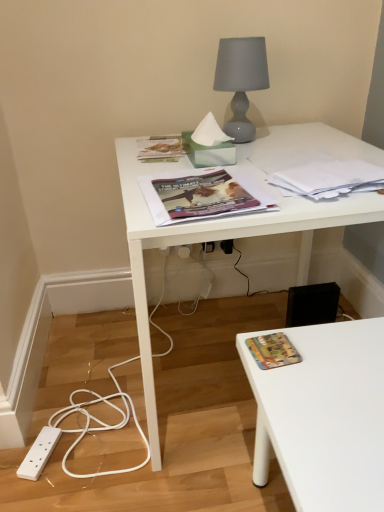
What is the approximate height of matte green paperback book at upper center, positioned as the 1th paperback book in top-to-bottom order?

The height of matte green paperback book at upper center, positioned as the 1th paperback book in top-to-bottom order, is 1.12 inches.

This screenshot has width=384, height=512. Describe the element at coordinates (318, 174) in the screenshot. I see `white paper at upper right, which is counted as the first paperback book, starting from the front` at that location.

This screenshot has height=512, width=384. Identify the location of white plastic power plugs and sockets at lower left. (39, 453).

Where is `black plastic electric outlet at lower center, which appears as the second electric outlet when viewed from the left`? This screenshot has height=512, width=384. black plastic electric outlet at lower center, which appears as the second electric outlet when viewed from the left is located at coordinates (227, 246).

Between point (230, 241) and point (373, 186), which one is positioned behind?

Positioned behind is point (230, 241).

Which object is further away from the camera taking this photo, black plastic electric outlet at lower center, which appears as the second electric outlet when viewed from the left, or white paper at upper right, which is the 1th paperback book from right to left?

black plastic electric outlet at lower center, which appears as the second electric outlet when viewed from the left, is further away from the camera.

Choose the correct answer: Is black plastic electric outlet at lower center, which appears as the second electric outlet when viewed from the left, inside white paper at upper right, the second paperback book in the top-to-bottom sequence, or outside it?

black plastic electric outlet at lower center, which appears as the second electric outlet when viewed from the left, lies outside white paper at upper right, the second paperback book in the top-to-bottom sequence.

How much distance is there between black plastic electric outlet at lower center, which appears as the second electric outlet when viewed from the left, and white paper at upper right, the second paperback book in the top-to-bottom sequence?

black plastic electric outlet at lower center, which appears as the second electric outlet when viewed from the left, is 28.89 inches away from white paper at upper right, the second paperback book in the top-to-bottom sequence.

Would you say black plastic electric outlet at lower center, which appears as the second electric outlet when viewed from the left, contains matte magazine at center, positioned as the first book cover in top-to-bottom order?

No, matte magazine at center, positioned as the first book cover in top-to-bottom order, is not inside black plastic electric outlet at lower center, which appears as the second electric outlet when viewed from the left.

Consider the image. Which object is thinner, black plastic electric outlet at lower center, which appears as the second electric outlet when viewed from the left, or matte magazine at center, the 2th book cover ordered from the bottom?

Thinner between the two is black plastic electric outlet at lower center, which appears as the second electric outlet when viewed from the left.

Which is behind, point (220, 243) or point (217, 192)?

Positioned behind is point (220, 243).

Can you confirm if black plastic electric outlet at lower center, which appears as the second electric outlet when viewed from the left, is taller than matte magazine at center, the 2th book cover ordered from the bottom?

Indeed, black plastic electric outlet at lower center, which appears as the second electric outlet when viewed from the left, has a greater height compared to matte magazine at center, the 2th book cover ordered from the bottom.

Which of these two, multicolored fabric book at lower right, which appears as the 1th book cover when ordered from the bottom, or matte magazine at center, the 2th book cover ordered from the bottom, stands shorter?

Standing shorter between the two is multicolored fabric book at lower right, which appears as the 1th book cover when ordered from the bottom.

From the image's perspective, is multicolored fabric book at lower right, which appears as the 1th book cover when ordered from the bottom, positioned above or below matte magazine at center, the 2th book cover ordered from the bottom?

Based on their image positions, multicolored fabric book at lower right, which appears as the 1th book cover when ordered from the bottom, is located beneath matte magazine at center, the 2th book cover ordered from the bottom.

From a real-world perspective, between multicolored fabric book at lower right, the second book cover from the top, and matte magazine at center, positioned as the first book cover in top-to-bottom order, who is vertically higher?

matte magazine at center, positioned as the first book cover in top-to-bottom order.

Visually, is multicolored fabric book at lower right, which appears as the 1th book cover when ordered from the bottom, positioned to the left or to the right of matte magazine at center, positioned as the first book cover in top-to-bottom order?

multicolored fabric book at lower right, which appears as the 1th book cover when ordered from the bottom, is positioned on matte magazine at center, positioned as the first book cover in top-to-bottom order,'s right side.

From a real-world perspective, which object stands above the other?

matte magazine at center, positioned as the first book cover in top-to-bottom order, is physically above.

Is white glossy desk at upper center positioned with its back to matte magazine at center, positioned as the first book cover in top-to-bottom order?

No, matte magazine at center, positioned as the first book cover in top-to-bottom order, is not at the back of white glossy desk at upper center.

Can you tell me how much white glossy desk at upper center and matte magazine at center, positioned as the first book cover in top-to-bottom order, differ in facing direction?

1.47 degrees.

Based on the photo, between white glossy desk at upper center and matte magazine at center, positioned as the first book cover in top-to-bottom order, which one is positioned behind?

matte magazine at center, positioned as the first book cover in top-to-bottom order, is further away from the camera.

From a real-world perspective, which is physically above, white paper at upper right, the second paperback book positioned from the back, or white glossy desk at upper center?

white paper at upper right, the second paperback book positioned from the back.

How far apart are white paper at upper right, placed as the first paperback book when sorted from bottom to top, and white glossy desk at upper center?

Answer: A distance of 6.10 inches exists between white paper at upper right, placed as the first paperback book when sorted from bottom to top, and white glossy desk at upper center.

Is point (337, 186) in front of point (376, 219)?

No, it is not.

Can you tell me how much white paper at upper right, the second paperback book in the top-to-bottom sequence, and white glossy desk at upper center differ in facing direction?

white paper at upper right, the second paperback book in the top-to-bottom sequence, and white glossy desk at upper center are facing 3.69 degrees away from each other.

From the image's perspective, does white glossy desk at upper center appear higher than white plastic electric outlet at lower center, which is the first electric outlet in left-to-right order?

Incorrect, from the image's perspective, white glossy desk at upper center is lower than white plastic electric outlet at lower center, which is the first electric outlet in left-to-right order.

From their relative heights in the image, would you say white glossy desk at upper center is taller or shorter than white plastic electric outlet at lower center, which is the 2th electric outlet in right-to-left order?

white glossy desk at upper center is taller than white plastic electric outlet at lower center, which is the 2th electric outlet in right-to-left order.

Considering the sizes of objects white glossy desk at upper center and white plastic electric outlet at lower center, which is the first electric outlet in left-to-right order, in the image provided, who is thinner, white glossy desk at upper center or white plastic electric outlet at lower center, which is the first electric outlet in left-to-right order,?

white plastic electric outlet at lower center, which is the first electric outlet in left-to-right order.

From a real-world perspective, who is located lower, white glossy desk at upper center or white plastic electric outlet at lower center, which is the 2th electric outlet in right-to-left order?

white plastic electric outlet at lower center, which is the 2th electric outlet in right-to-left order.

From the image's perspective, does matte magazine at center, positioned as the first book cover in top-to-bottom order, appear lower than matte gray glass lamp at upper center?

Yes.

Is matte magazine at center, the 2th book cover ordered from the bottom, spatially inside matte gray glass lamp at upper center, or outside of it?

matte magazine at center, the 2th book cover ordered from the bottom, is not inside matte gray glass lamp at upper center, it's outside.

You are a GUI agent. You are given a task and a screenshot of the screen. Output one action in this format:
    pyautogui.click(x=<x>, y=<y>)
    Task: Click on the lamp behind the matte magazine at center, positioned as the first book cover in top-to-bottom order
    This screenshot has width=384, height=512.
    Given the screenshot: What is the action you would take?
    pyautogui.click(x=241, y=80)

What's the angular difference between matte magazine at center, the 2th book cover ordered from the bottom, and matte gray glass lamp at upper center's facing directions?

3.72 degrees separate the facing orientations of matte magazine at center, the 2th book cover ordered from the bottom, and matte gray glass lamp at upper center.

Which electric outlet is the 1st one when counting from the left side of the white paper at upper right, the second paperback book positioned from the back? Please provide its 2D coordinates.

[(227, 246)]

Identify the location of the 2nd book cover in front of the black plastic electric outlet at lower center, which appears as the second electric outlet when viewed from the left. This screenshot has width=384, height=512. 202,196.

Estimate the real-world distances between objects in this image. Which object is further from white glossy desk at upper center, black plastic electric outlet at lower center, which is the 1th electric outlet in right-to-left order, or matte green paperback book at upper center, which appears as the 1th paperback book when viewed from the left?

Among the two, black plastic electric outlet at lower center, which is the 1th electric outlet in right-to-left order, is located further to white glossy desk at upper center.

Based on their spatial positions, is matte gray glass lamp at upper center or white glossy desk at upper center further from matte green paperback book at upper center, the 1th paperback book viewed from the back?

Based on the image, white glossy desk at upper center appears to be further to matte green paperback book at upper center, the 1th paperback book viewed from the back.

From the image, which object appears to be farther from multicolored fabric book at lower right, which appears as the 1th book cover when ordered from the bottom, white plastic electric outlet at lower center, which is the first electric outlet in left-to-right order, or white paper at upper right, which is the 1th paperback book from right to left?

white plastic electric outlet at lower center, which is the first electric outlet in left-to-right order.

Looking at the image, which one is located further to matte gray glass lamp at upper center, white plastic power plugs and sockets at lower left or white paper at upper right, the second paperback book positioned from the back?

white plastic power plugs and sockets at lower left is positioned further to the anchor matte gray glass lamp at upper center.

Which object lies nearer to the anchor point matte green paperback book at upper center, which appears as the 1th paperback book when viewed from the left, white glossy desk at upper center or white paper at upper right, which is counted as the first paperback book, starting from the front?

white glossy desk at upper center lies closer to matte green paperback book at upper center, which appears as the 1th paperback book when viewed from the left, than the other object.

Estimate the real-world distances between objects in this image. Which object is closer to white plastic power plugs and sockets at lower left, white plastic electric outlet at lower center, which is the 2th electric outlet in right-to-left order, or multicolored fabric book at lower right, the second book cover from the top?

multicolored fabric book at lower right, the second book cover from the top.

When comparing their distances from white plastic electric outlet at lower center, which is the first electric outlet in left-to-right order, does white paper at upper right, which is counted as the first paperback book, starting from the front, or matte magazine at center, positioned as the first book cover in top-to-bottom order, seem closer?

white paper at upper right, which is counted as the first paperback book, starting from the front, is positioned closer to the anchor white plastic electric outlet at lower center, which is the first electric outlet in left-to-right order.

Considering their positions, is multicolored fabric book at lower right, the second book cover from the top, positioned further to matte gray glass lamp at upper center than white glossy desk at upper center?

Among the two, multicolored fabric book at lower right, the second book cover from the top, is located further to matte gray glass lamp at upper center.

The width and height of the screenshot is (384, 512). I want to click on electric outlet between white glossy desk at upper center and black plastic electric outlet at lower center, which appears as the second electric outlet when viewed from the left, in the front-back direction, so click(x=183, y=251).

Identify the location of paperback book between matte gray glass lamp at upper center and white plastic electric outlet at lower center, which is the first electric outlet in left-to-right order, from front to back. This screenshot has height=512, width=384. [160, 149].

The height and width of the screenshot is (512, 384). Find the location of `electric outlet between white paper at upper right, the second paperback book positioned from the back, and black plastic electric outlet at lower center, which is the 1th electric outlet in right-to-left order, from front to back`. electric outlet between white paper at upper right, the second paperback book positioned from the back, and black plastic electric outlet at lower center, which is the 1th electric outlet in right-to-left order, from front to back is located at coordinates (183, 251).

Locate an element on the screen. The height and width of the screenshot is (512, 384). power plugs and sockets between matte magazine at center, the 2th book cover ordered from the bottom, and white plastic electric outlet at lower center, which is the 2th electric outlet in right-to-left order, in the front-back direction is located at coordinates (39, 453).